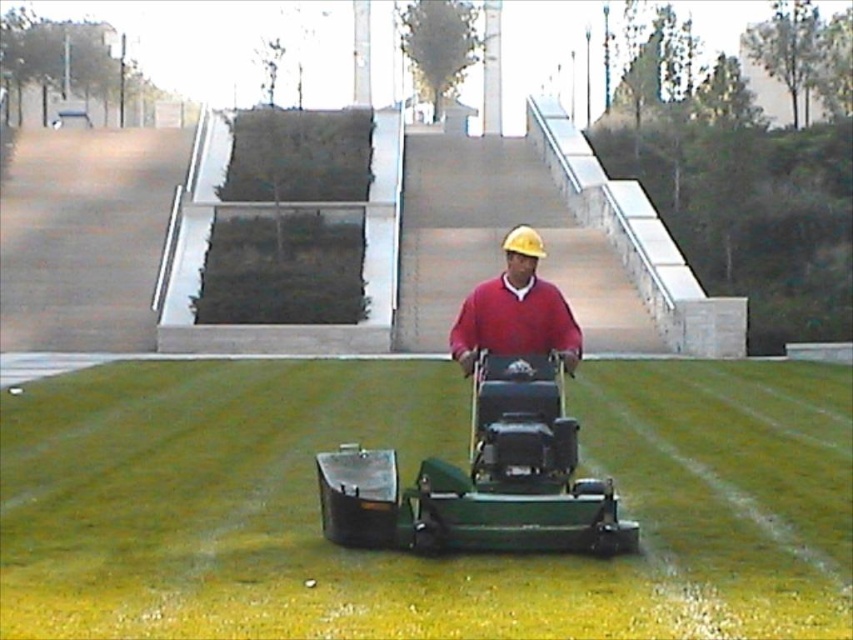
Question: Does green grass at center appear under matte red sweater at center?

Choices:
 (A) yes
 (B) no

Answer: (A)

Question: Does green grass at center appear over matte red sweater at center?

Choices:
 (A) no
 (B) yes

Answer: (A)

Question: Which point appears closest to the camera in this image?

Choices:
 (A) (74, 396)
 (B) (549, 314)

Answer: (B)

Question: Which point is farther to the camera?

Choices:
 (A) matte red sweater at center
 (B) green grass at center

Answer: (A)

Question: Does green grass at center appear under matte red sweater at center?

Choices:
 (A) no
 (B) yes

Answer: (B)